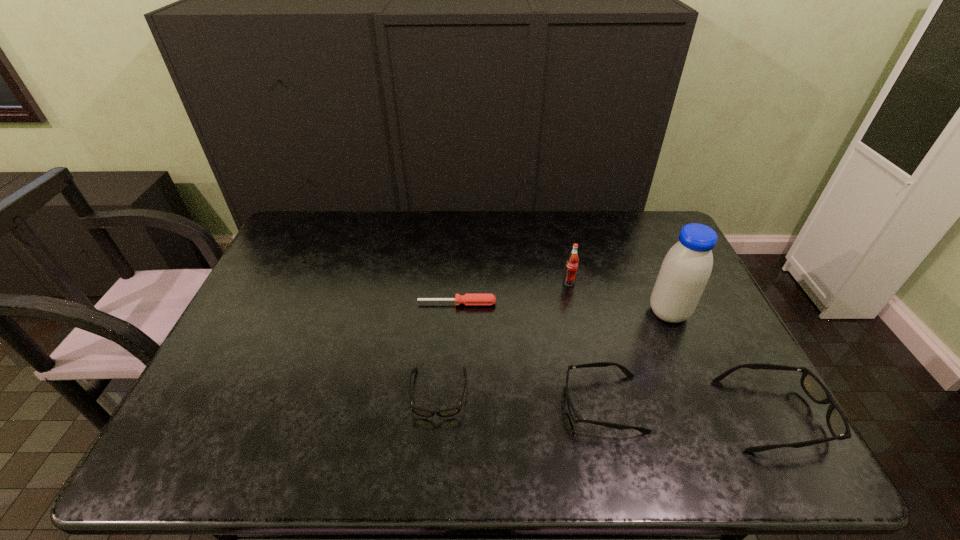
Please point a vacant point for placing a spectacles on the left. Please provide its 2D coordinates. Your answer should be formatted as a tuple, i.e. [(x, y)], where the tuple contains the x and y coordinates of a point satisfying the conditions above.

[(280, 383)]